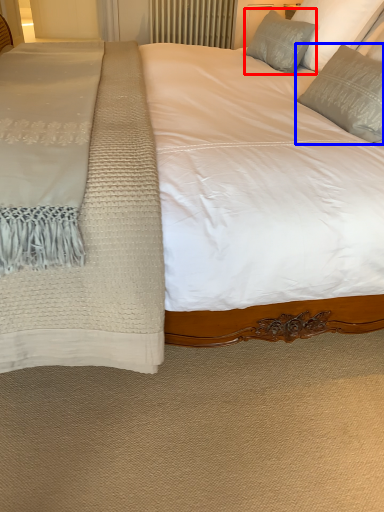
Question: Which object is further to the camera taking this photo, pillow (highlighted by a red box) or pillow (highlighted by a blue box)?

Choices:
 (A) pillow
 (B) pillow

Answer: (A)